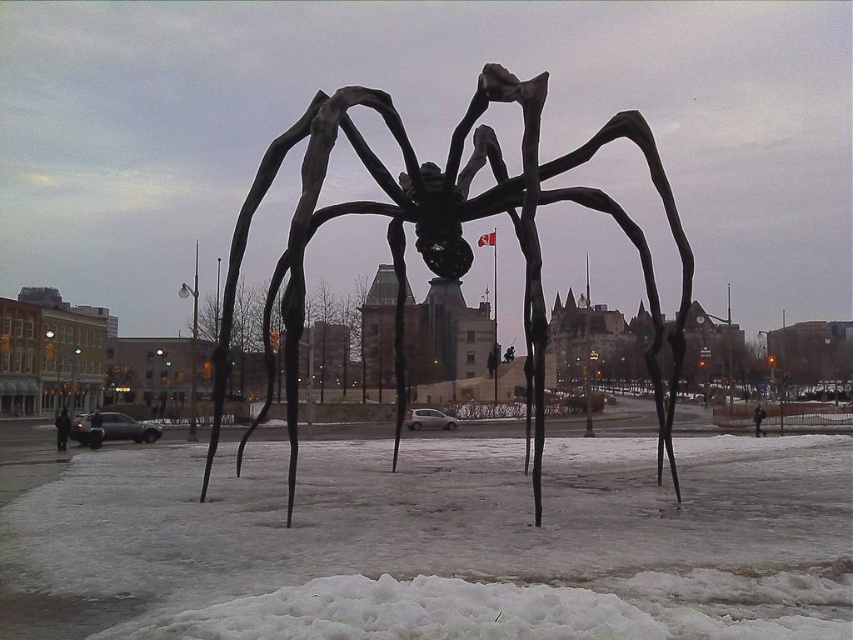
Who is more forward, (115, 522) or (318, 125)?

Point (115, 522)

Is white powdery snow at center bigger than black matte spider at center?

No, white powdery snow at center is not bigger than black matte spider at center.

This screenshot has height=640, width=853. I want to click on white powdery snow at center, so click(x=438, y=545).